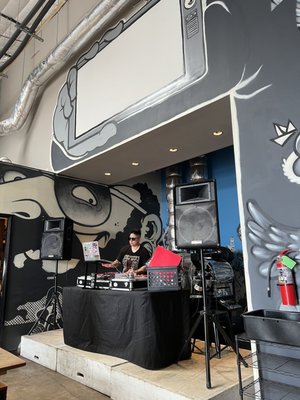
Where is `booth`? This screenshot has height=400, width=300. booth is located at coordinates (111, 319).